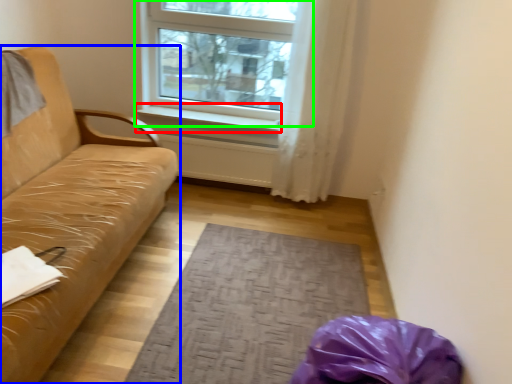
Question: Which object is the farthest from window sill (highlighted by a red box)? Choose among these: studio couch (highlighted by a blue box) or window (highlighted by a green box).

Choices:
 (A) studio couch
 (B) window

Answer: (A)